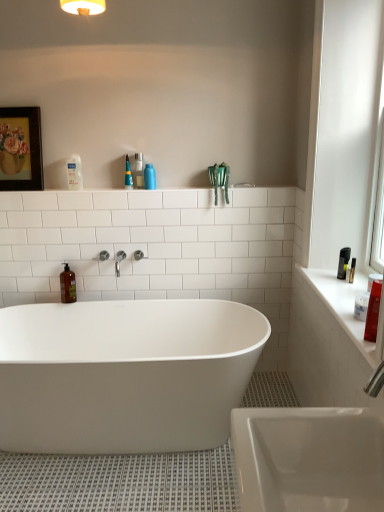
Question: Is white glossy bathtub at center surrounded by blue matte bottle at upper center, which is the third cleaning product in left-to-right order?

Choices:
 (A) no
 (B) yes

Answer: (A)

Question: Considering the relative sizes of blue matte bottle at upper center, which appears as the second cleaning product when viewed from the top, and white glossy bathtub at center in the image provided, is blue matte bottle at upper center, which appears as the second cleaning product when viewed from the top, smaller than white glossy bathtub at center?

Choices:
 (A) yes
 (B) no

Answer: (A)

Question: Does blue matte bottle at upper center, which is counted as the 3th cleaning product, starting from the back, have a lesser width compared to white glossy bathtub at center?

Choices:
 (A) yes
 (B) no

Answer: (A)

Question: Is there a large distance between blue matte bottle at upper center, which is the third cleaning product in left-to-right order, and white glossy bathtub at center?

Choices:
 (A) yes
 (B) no

Answer: (A)

Question: From a real-world perspective, is blue matte bottle at upper center, which is the third cleaning product in left-to-right order, beneath white glossy bathtub at center?

Choices:
 (A) yes
 (B) no

Answer: (B)

Question: Is blue matte bottle at upper center, which appears as the second cleaning product when viewed from the top, with white glossy bathtub at center?

Choices:
 (A) yes
 (B) no

Answer: (B)

Question: From a real-world perspective, is translucent plastic spray bottle at upper center, the 3th cleaning product from the front, on top of brown matte bottle at left, the third cleaning product in the top-to-bottom sequence?

Choices:
 (A) yes
 (B) no

Answer: (A)

Question: Is translucent plastic spray bottle at upper center, placed as the 3th cleaning product when sorted from right to left, not inside brown matte bottle at left, the third cleaning product in the top-to-bottom sequence?

Choices:
 (A) yes
 (B) no

Answer: (A)

Question: Is translucent plastic spray bottle at upper center, the fourth cleaning product positioned from the bottom, to the left of brown matte bottle at left, positioned as the 1th cleaning product in back-to-front order, from the viewer's perspective?

Choices:
 (A) yes
 (B) no

Answer: (B)

Question: Is translucent plastic spray bottle at upper center, arranged as the first cleaning product when viewed from the top, turned away from brown matte bottle at left, placed as the 2th cleaning product when sorted from bottom to top?

Choices:
 (A) no
 (B) yes

Answer: (A)

Question: Is translucent plastic spray bottle at upper center, the second cleaning product from the left, wider than brown matte bottle at left, the fourth cleaning product in the right-to-left sequence?

Choices:
 (A) yes
 (B) no

Answer: (B)

Question: Is the depth of translucent plastic spray bottle at upper center, the fourth cleaning product positioned from the bottom, less than that of brown matte bottle at left, the fourth cleaning product in the right-to-left sequence?

Choices:
 (A) no
 (B) yes

Answer: (B)

Question: Is translucent plastic spray bottle at upper center, marked as the second cleaning product in a back-to-front arrangement, smaller than blue matte bottle at upper center, which appears as the second cleaning product when viewed from the top?

Choices:
 (A) yes
 (B) no

Answer: (B)